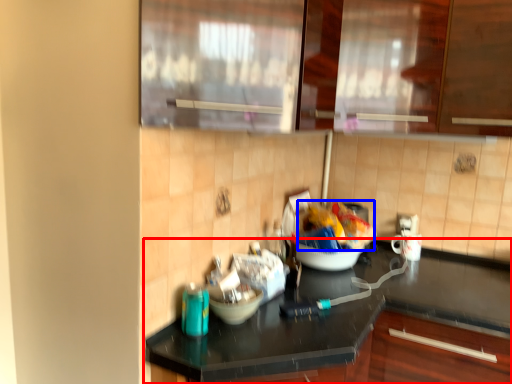
Question: Which of the following is the closest to the observer, countertop (highlighted by a red box) or food (highlighted by a blue box)?

Choices:
 (A) countertop
 (B) food

Answer: (A)